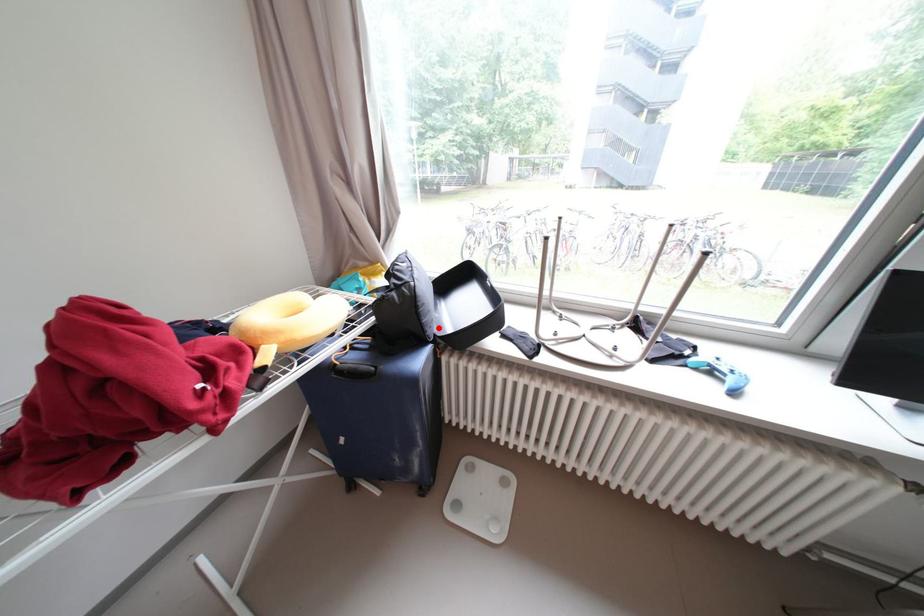
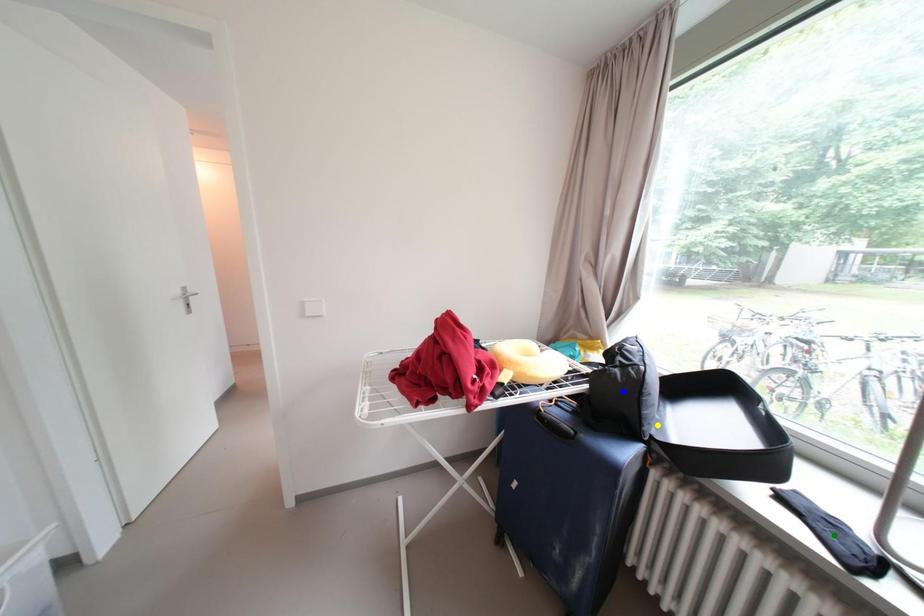
Question: I am providing you with two images of the same scene from different viewpoints. A red point is marked on the first image. You are given multiple points on the second image. Which point in image 2 represents the same 3d spot as the red point in image 1?

Choices:
 (A) yellow point
 (B) blue point
 (C) green point

Answer: (A)